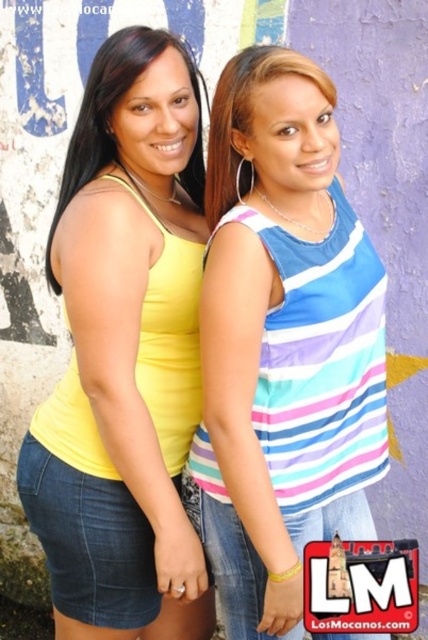
You are a photographer trying to capture both the matte yellow tank top at left and the matte blue tank top at center in a single frame. Which tank top should you adjust your focus on to ensure both are in frame without cropping?

The matte yellow tank top at left is taller than the matte blue tank top at center, so you should focus on the taller matte yellow tank top at left to ensure both are in frame without cropping.

You are a fashion designer observing two women in the image. The first woman wears a matte yellow tank top at left, and the second wears a matte blue tank top at center. Which tank top has a greater width?

The matte yellow tank top at left has a greater width than the matte blue tank top at center.

You are a photographer trying to capture a closeup of the two women in the image. You need to focus on the yellow matte tank top at left and the matte blue tank top at center. Based on their positions, which tank top should you adjust your camera to focus on first if you want to start from the left side?

The yellow matte tank top at left is to the left of the matte blue tank top at center, so you should focus on the yellow matte tank top at left first as it is positioned further to the left side.